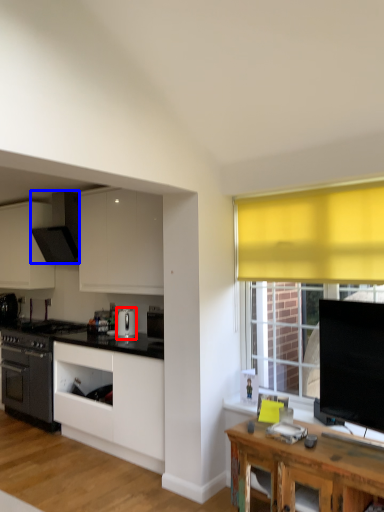
Question: Which of the following is the farthest to the observer, kitchen appliance (highlighted by a red box) or kitchen appliance (highlighted by a blue box)?

Choices:
 (A) kitchen appliance
 (B) kitchen appliance

Answer: (B)